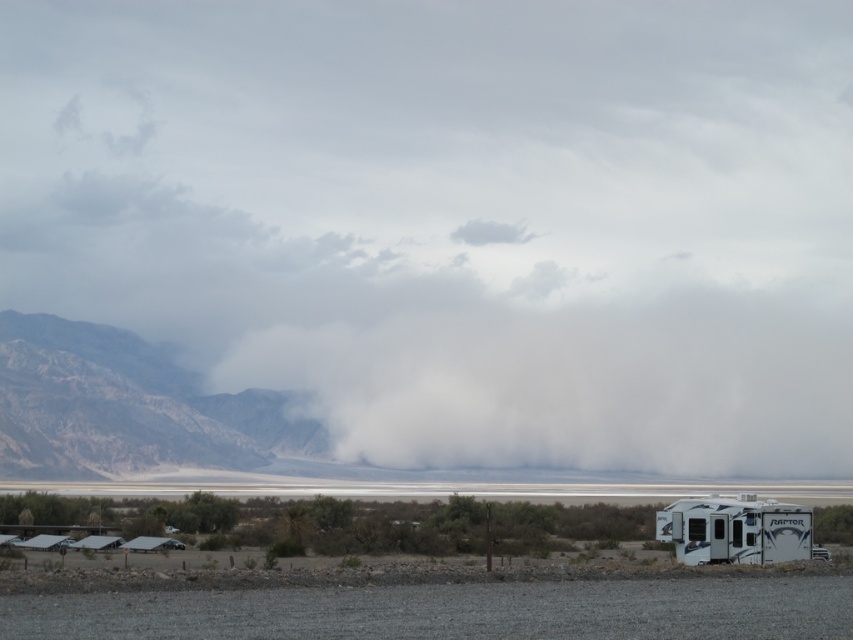
Consider the image. You are planning to take a photo of the rugged brown mountain at left and the white glossy recreational vehicle at lower right. Which object should you focus on first if you want to capture both in a single frame without moving the camera?

You should focus on the rugged brown mountain at left first because its width is larger than the white glossy recreational vehicle at lower right, so it will occupy more space in the frame and ensure both are captured without needing to adjust the camera position.

You are standing at the point labeled point [125,406] in the image. Which object is directly behind you?

The rugged brown mountain at left is represented by point [125,406], so the rugged brown mountain at left is directly behind you.